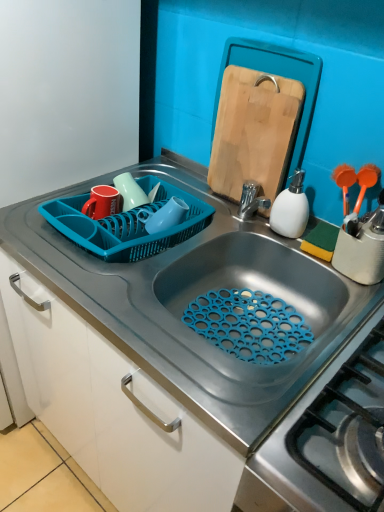
Locate an element on the screen. The height and width of the screenshot is (512, 384). free region on the left part of wooden cutting board at upper right is located at coordinates (188, 193).